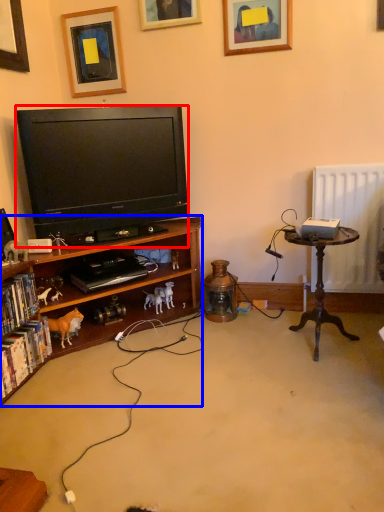
Question: Which of the following is the closest to the observer, television (highlighted by a red box) or bookcase (highlighted by a blue box)?

Choices:
 (A) television
 (B) bookcase

Answer: (B)